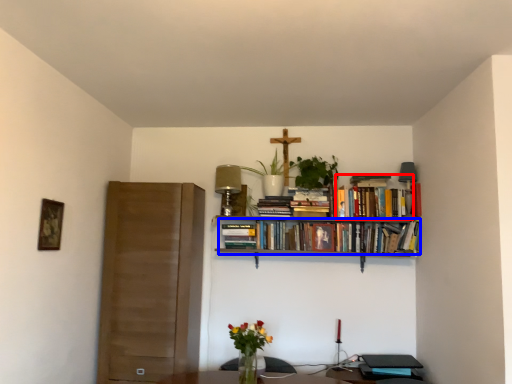
Question: Among these objects, which one is farthest to the camera, book (highlighted by a red box) or book (highlighted by a blue box)?

Choices:
 (A) book
 (B) book

Answer: (A)